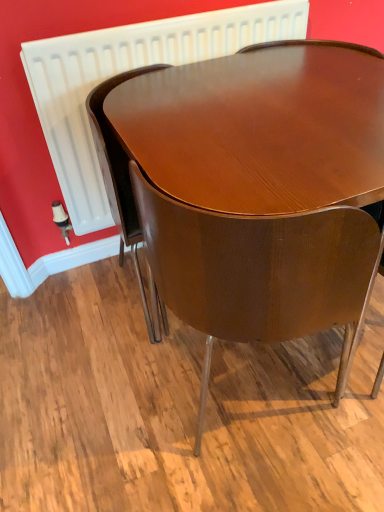
You are a GUI agent. You are given a task and a screenshot of the screen. Output one action in this format:
    pyautogui.click(x=<x>, y=<y>)
    Task: Click on the vacant region to the left of glossy wood chair at center, the first chair in the left-to-right sequence
    
    Given the screenshot: What is the action you would take?
    pyautogui.click(x=89, y=304)